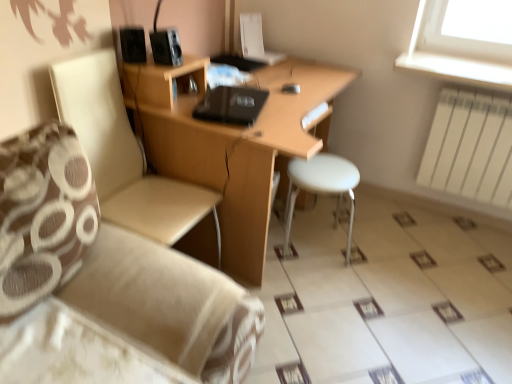
What is the approximate height of white plastic stool at center?

white plastic stool at center is 18.68 inches tall.

Find the location of `black plastic speaker at upper center, marked as the 1th speaker in a right-to-left arrangement`. black plastic speaker at upper center, marked as the 1th speaker in a right-to-left arrangement is located at coordinates (166, 46).

Image resolution: width=512 pixels, height=384 pixels. In order to click on beige fabric couch at lower left in this screenshot , I will do `click(112, 264)`.

Measure the distance between black matte laptop at center and camera.

black matte laptop at center and camera are 5.62 feet apart.

Describe the element at coordinates (124, 155) in the screenshot. I see `beige fabric chair at left` at that location.

The width and height of the screenshot is (512, 384). I want to click on black matte speaker at upper left, acting as the first speaker starting from the left, so click(x=133, y=44).

Is black plastic speaker at upper center, which appears as the 2th speaker when viewed from the left, with white plastic stool at center?

No, black plastic speaker at upper center, which appears as the 2th speaker when viewed from the left, is not beside white plastic stool at center.

Considering the points (153, 57) and (295, 176), which point is behind, point (153, 57) or point (295, 176)?

The point (295, 176) is behind.

Considering the positions of objects black plastic speaker at upper center, marked as the 1th speaker in a right-to-left arrangement, and white plastic stool at center in the image provided, who is more to the right, black plastic speaker at upper center, marked as the 1th speaker in a right-to-left arrangement, or white plastic stool at center?

white plastic stool at center is more to the right.

From the image's perspective, starting from the white plastic stool at center, which speaker is the 1st one above? Please provide its 2D coordinates.

[(166, 46)]

Considering their positions, is white plastic stool at center located in front of or behind wooden desk at center?

Visually, white plastic stool at center is located behind wooden desk at center.

At what (x,y) coordinates should I click in order to perform the action: click on bar stool located underneath the wooden desk at center (from a real-world perspective). Please return your answer as a coordinate pair (x, y). Looking at the image, I should click on (321, 187).

How many degrees apart are the facing directions of white plastic stool at center and wooden desk at center?

0.3 degrees separate the facing orientations of white plastic stool at center and wooden desk at center.

Can you tell me how much white metal radiator at right and wooden desk at center differ in facing direction?

86.2 degrees.

In terms of size, does white metal radiator at right appear bigger or smaller than wooden desk at center?

Considering their sizes, white metal radiator at right takes up less space than wooden desk at center.

From their relative heights in the image, would you say white metal radiator at right is taller or shorter than wooden desk at center?

Considering their sizes, white metal radiator at right has less height than wooden desk at center.

Which point is more distant from viewer, (x=498, y=136) or (x=257, y=166)?

The point (x=498, y=136) is farther from the camera.

At what (x,y) coordinates should I click in order to perform the action: click on chair that appears above the beige fabric couch at lower left (from the image's perspective). Please return your answer as a coordinate pair (x, y). The width and height of the screenshot is (512, 384). Looking at the image, I should click on (124, 155).

Is beige fabric couch at lower left oriented towards beige fabric chair at left?

No, beige fabric couch at lower left is not aimed at beige fabric chair at left.

From the image's perspective, is beige fabric couch at lower left over beige fabric chair at left?

Incorrect, from the image's perspective, beige fabric couch at lower left is lower than beige fabric chair at left.

Is point (84, 187) in front of point (78, 104)?

Yes, point (84, 187) is in front of point (78, 104).

Is black matte speaker at upper left, acting as the first speaker starting from the left, wider or thinner than black matte laptop at center?

Considering their sizes, black matte speaker at upper left, acting as the first speaker starting from the left, looks slimmer than black matte laptop at center.

Between black matte speaker at upper left, which is the 2th speaker in right-to-left order, and black matte laptop at center, which one appears on the right side from the viewer's perspective?

Positioned to the right is black matte laptop at center.

This screenshot has width=512, height=384. I want to click on laptop on the right of black matte speaker at upper left, acting as the first speaker starting from the left, so click(x=231, y=105).

Is black matte speaker at upper left, which is the 2th speaker in right-to-left order, situated inside black matte laptop at center or outside?

black matte speaker at upper left, which is the 2th speaker in right-to-left order, lies outside black matte laptop at center.

Which of these two, white plastic stool at center or beige fabric chair at left, is thinner?

With smaller width is white plastic stool at center.

Can you confirm if white plastic stool at center is bigger than beige fabric chair at left?

No, white plastic stool at center is not bigger than beige fabric chair at left.

Is beige fabric chair at left surrounded by white plastic stool at center?

Definitely not — beige fabric chair at left is not inside white plastic stool at center.

From the image's perspective, is white plastic stool at center positioned above or below beige fabric chair at left?

white plastic stool at center is situated lower than beige fabric chair at left in the image.

Is black matte speaker at upper left, acting as the first speaker starting from the left, positioned beyond the bounds of black plastic speaker at upper center, marked as the 1th speaker in a right-to-left arrangement?

That's correct, black matte speaker at upper left, acting as the first speaker starting from the left, is outside of black plastic speaker at upper center, marked as the 1th speaker in a right-to-left arrangement.

From the image's perspective, which one is positioned lower, black matte speaker at upper left, which is the 2th speaker in right-to-left order, or black plastic speaker at upper center, marked as the 1th speaker in a right-to-left arrangement?

black plastic speaker at upper center, marked as the 1th speaker in a right-to-left arrangement.

This screenshot has width=512, height=384. Identify the location of the 1st speaker to the left of the white plastic stool at center, starting your count from the anchor. (166, 46).

In order to click on desk above the white plastic stool at center (from a real-world perspective) in this screenshot , I will do `click(240, 149)`.

Which object lies nearer to the anchor point wooden desk at center, black matte laptop at center or beige fabric couch at lower left?

black matte laptop at center.

Consider the image. Based on their spatial positions, is black plastic speaker at upper center, marked as the 1th speaker in a right-to-left arrangement, or white plastic stool at center closer to black matte speaker at upper left, acting as the first speaker starting from the left?

Among the two, black plastic speaker at upper center, marked as the 1th speaker in a right-to-left arrangement, is located nearer to black matte speaker at upper left, acting as the first speaker starting from the left.

Which object lies further to the anchor point white plastic stool at center, black matte speaker at upper left, acting as the first speaker starting from the left, or black matte laptop at center?

black matte speaker at upper left, acting as the first speaker starting from the left, is further to white plastic stool at center.

From the image, which object appears to be nearer to black matte speaker at upper left, acting as the first speaker starting from the left, beige fabric couch at lower left or white plastic stool at center?

beige fabric couch at lower left.

Which object lies nearer to the anchor point beige fabric couch at lower left, wooden desk at center or white plastic stool at center?

wooden desk at center is closer to beige fabric couch at lower left.

Considering their positions, is beige fabric couch at lower left positioned further to white metal radiator at right than black matte laptop at center?

Among the two, beige fabric couch at lower left is located further to white metal radiator at right.

Estimate the real-world distances between objects in this image. Which object is further from black matte laptop at center, beige fabric chair at left or white metal radiator at right?

Based on the image, white metal radiator at right appears to be further to black matte laptop at center.

Estimate the real-world distances between objects in this image. Which object is further from white metal radiator at right, beige fabric couch at lower left or wooden desk at center?

Based on the image, beige fabric couch at lower left appears to be further to white metal radiator at right.

The width and height of the screenshot is (512, 384). Identify the location of chair between beige fabric couch at lower left and black matte laptop at center from front to back. (124, 155).

This screenshot has width=512, height=384. What are the coordinates of `laptop between black matte speaker at upper left, which is the 2th speaker in right-to-left order, and white metal radiator at right` in the screenshot? It's located at (231, 105).

At what (x,y) coordinates should I click in order to perform the action: click on speaker situated between black matte speaker at upper left, acting as the first speaker starting from the left, and wooden desk at center from left to right. Please return your answer as a coordinate pair (x, y). Image resolution: width=512 pixels, height=384 pixels. Looking at the image, I should click on (166, 46).

Locate an element on the screen. The width and height of the screenshot is (512, 384). laptop between black plastic speaker at upper center, which appears as the 2th speaker when viewed from the left, and white plastic stool at center from left to right is located at coordinates (231, 105).